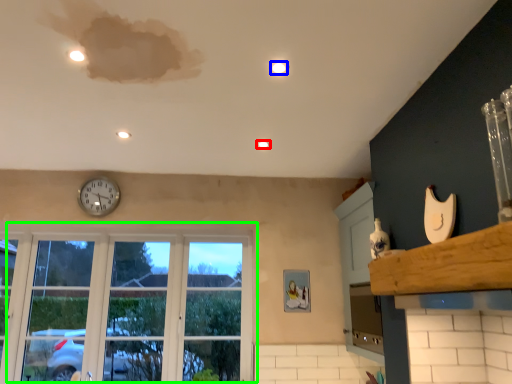
Question: Estimate the real-world distances between objects in this image. Which object is closer to light (highlighted by a red box), light (highlighted by a blue box) or window (highlighted by a green box)?

Choices:
 (A) light
 (B) window

Answer: (A)